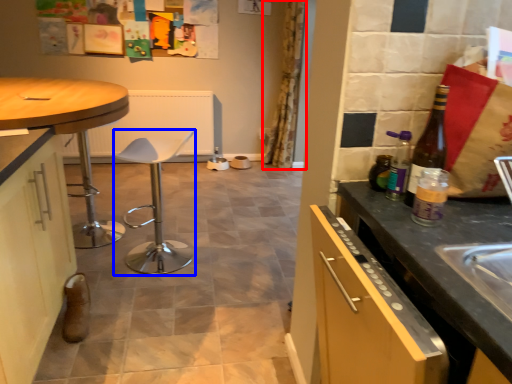
Question: Which of the following is the farthest to the observer, curtain (highlighted by a red box) or bar stool (highlighted by a blue box)?

Choices:
 (A) curtain
 (B) bar stool

Answer: (A)